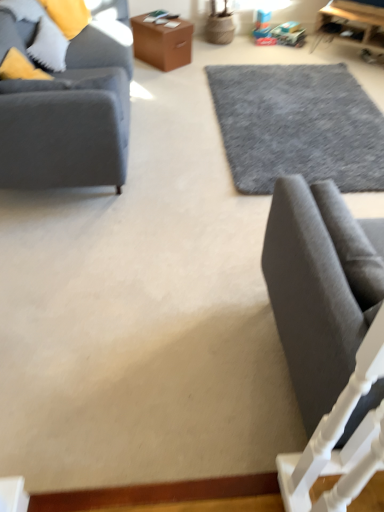
Question: From a real-world perspective, is matte gray fabric couch at left, the first studio couch viewed from the back, positioned under wooden table at upper right, marked as the second table in a left-to-right arrangement, based on gravity?

Choices:
 (A) no
 (B) yes

Answer: (A)

Question: Is matte gray fabric couch at left, the 2th studio couch from the front, at the right side of wooden table at upper right, marked as the second table in a left-to-right arrangement?

Choices:
 (A) no
 (B) yes

Answer: (A)

Question: Is matte gray fabric couch at left, positioned as the 1th studio couch in left-to-right order, facing away from wooden table at upper right, marked as the second table in a left-to-right arrangement?

Choices:
 (A) yes
 (B) no

Answer: (B)

Question: Does matte gray fabric couch at left, positioned as the 1th studio couch in left-to-right order, come behind wooden table at upper right, marked as the second table in a left-to-right arrangement?

Choices:
 (A) yes
 (B) no

Answer: (B)

Question: Can you confirm if matte gray fabric couch at left, the 2th studio couch from the front, is wider than wooden table at upper right, acting as the 1th table starting from the right?

Choices:
 (A) yes
 (B) no

Answer: (A)

Question: Is matte gray fabric couch at left, the first studio couch viewed from the back, taller or shorter than dark gray fabric studio couch at lower right, which is counted as the second studio couch, starting from the left?

Choices:
 (A) short
 (B) tall

Answer: (A)

Question: Does point [72, 71] appear closer or farther from the camera than point [274, 200]?

Choices:
 (A) farther
 (B) closer

Answer: (A)

Question: Which is correct: matte gray fabric couch at left, which is counted as the second studio couch, starting from the right, is inside dark gray fabric studio couch at lower right, placed as the 1th studio couch when sorted from right to left, or outside of it?

Choices:
 (A) outside
 (B) inside

Answer: (A)

Question: From the image's perspective, relative to dark gray fabric studio couch at lower right, the 2th studio couch positioned from the back, is matte gray fabric couch at left, positioned as the 1th studio couch in left-to-right order, above or below?

Choices:
 (A) below
 (B) above

Answer: (B)

Question: Choose the correct answer: Is gray wool rug at center inside brown leather box at upper center, the 1th table in the left-to-right sequence, or outside it?

Choices:
 (A) inside
 (B) outside

Answer: (B)

Question: From a real-world perspective, is gray wool rug at center positioned above or below brown leather box at upper center, which is the second table from right to left?

Choices:
 (A) above
 (B) below

Answer: (B)

Question: Looking at the image, does gray wool rug at center seem bigger or smaller compared to brown leather box at upper center, which is the second table from right to left?

Choices:
 (A) big
 (B) small

Answer: (A)

Question: Considering the positions of point (380, 164) and point (148, 53), is point (380, 164) closer or farther from the camera than point (148, 53)?

Choices:
 (A) closer
 (B) farther

Answer: (A)

Question: From a real-world perspective, is matte gray fabric couch at left, positioned as the 1th studio couch in left-to-right order, above or below brown leather box at upper center, which is the second table from right to left?

Choices:
 (A) above
 (B) below

Answer: (A)

Question: Is matte gray fabric couch at left, the 1th studio couch in the top-to-bottom sequence, inside or outside of brown leather box at upper center, which is the second table from right to left?

Choices:
 (A) outside
 (B) inside

Answer: (A)